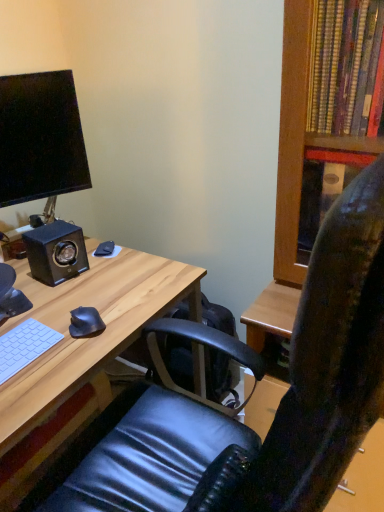
Where is `spots to the right of black matte mouse at lower left, the 1th mouse from the bottom`? spots to the right of black matte mouse at lower left, the 1th mouse from the bottom is located at coordinates (127, 322).